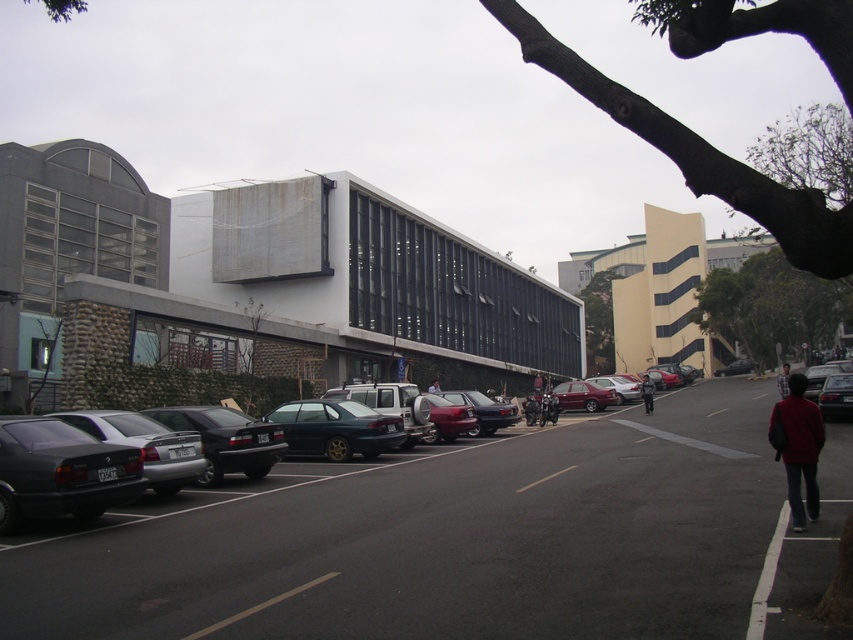
Is metallic gray cars at center-left positioned in front of dark red sweater at lower right?

That is True.

What do you see at coordinates (440, 540) in the screenshot? I see `metallic gray cars at center-left` at bounding box center [440, 540].

This screenshot has height=640, width=853. Describe the element at coordinates (440, 540) in the screenshot. I see `metallic gray cars at center-left` at that location.

What are the coordinates of `metallic gray cars at center-left` in the screenshot? It's located at (440, 540).

What do you see at coordinates (766, 577) in the screenshot? I see `white painted line at lower right` at bounding box center [766, 577].

Where is `white painted line at lower right`? Image resolution: width=853 pixels, height=640 pixels. white painted line at lower right is located at coordinates (766, 577).

Between point (106, 502) and point (537, 385), which one is positioned behind?

Positioned behind is point (537, 385).

Who is shorter, matte black car at left or dark brown leather jacket at center?

Standing shorter between the two is dark brown leather jacket at center.

At what (x,y) coordinates should I click in order to perform the action: click on matte black car at left. Please return your answer as a coordinate pair (x, y). Looking at the image, I should click on (61, 472).